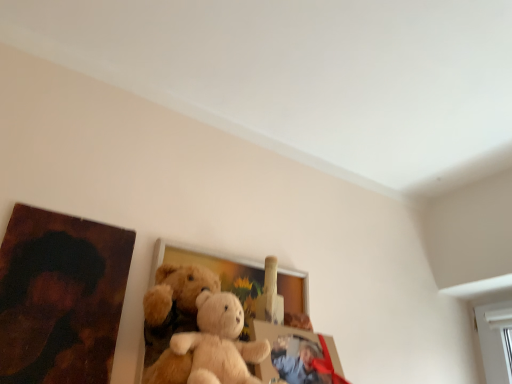
Question: Which direction should I rotate to look at matte plastic picture frame at center, the third picture frame viewed from the left, — up or down?

Choices:
 (A) up
 (B) down

Answer: (B)

Question: Can you confirm if wooden painting at left, acting as the 1th picture frame starting from the left, is shorter than wooden picture frame at center, which is the 2th picture frame from left to right?

Choices:
 (A) yes
 (B) no

Answer: (A)

Question: From a real-world perspective, is wooden painting at left, which ranks as the 3th picture frame in right-to-left order, physically below wooden picture frame at center, which is the 2th picture frame from left to right?

Choices:
 (A) no
 (B) yes

Answer: (A)

Question: Does wooden painting at left, which ranks as the 3th picture frame in right-to-left order, turn towards wooden picture frame at center, which is the 2th picture frame from left to right?

Choices:
 (A) no
 (B) yes

Answer: (A)

Question: From the image's perspective, is wooden painting at left, acting as the 1th picture frame starting from the left, under wooden picture frame at center, which is the 2th picture frame from left to right?

Choices:
 (A) no
 (B) yes

Answer: (A)

Question: Can you confirm if wooden painting at left, acting as the 1th picture frame starting from the left, is positioned to the left of wooden picture frame at center, which is the 2th picture frame in right-to-left order?

Choices:
 (A) no
 (B) yes

Answer: (B)

Question: Can you confirm if wooden painting at left, acting as the 1th picture frame starting from the left, is taller than wooden picture frame at center, which is the 2th picture frame in right-to-left order?

Choices:
 (A) no
 (B) yes

Answer: (A)

Question: Does matte plastic picture frame at center, the 1th picture frame from the right, have a lesser height compared to wooden picture frame at center, which is the 2th picture frame in right-to-left order?

Choices:
 (A) yes
 (B) no

Answer: (A)

Question: Is matte plastic picture frame at center, the 1th picture frame from the right, outside wooden picture frame at center, which is the 2th picture frame from left to right?

Choices:
 (A) yes
 (B) no

Answer: (A)

Question: Is matte plastic picture frame at center, the 1th picture frame from the right, at the right side of wooden picture frame at center, which is the 2th picture frame in right-to-left order?

Choices:
 (A) yes
 (B) no

Answer: (A)

Question: Can you confirm if matte plastic picture frame at center, the third picture frame viewed from the left, is thinner than wooden picture frame at center, which is the 2th picture frame in right-to-left order?

Choices:
 (A) no
 (B) yes

Answer: (A)

Question: From the image's perspective, does matte plastic picture frame at center, the 1th picture frame from the right, appear lower than wooden picture frame at center, which is the 2th picture frame in right-to-left order?

Choices:
 (A) no
 (B) yes

Answer: (B)

Question: Considering the relative sizes of matte plastic picture frame at center, the third picture frame viewed from the left, and wooden picture frame at center, which is the 2th picture frame from left to right, in the image provided, is matte plastic picture frame at center, the third picture frame viewed from the left, wider than wooden picture frame at center, which is the 2th picture frame from left to right,?

Choices:
 (A) yes
 (B) no

Answer: (A)

Question: Are wooden picture frame at center, which is the 2th picture frame in right-to-left order, and wooden painting at left, acting as the 1th picture frame starting from the left, beside each other?

Choices:
 (A) yes
 (B) no

Answer: (B)